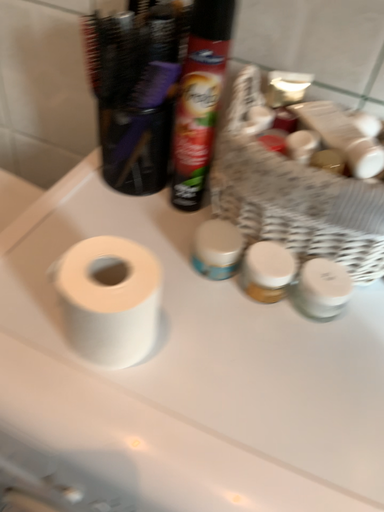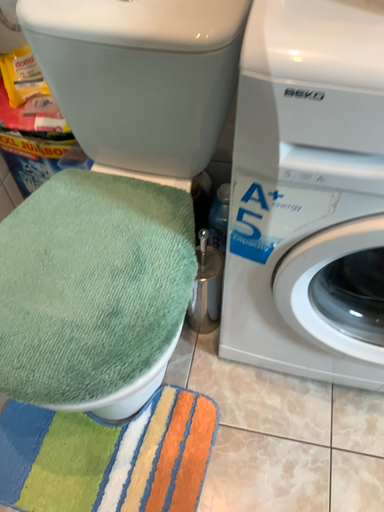
Question: Which way did the camera rotate in the video?

Choices:
 (A) rotated upward
 (B) rotated downward

Answer: (B)